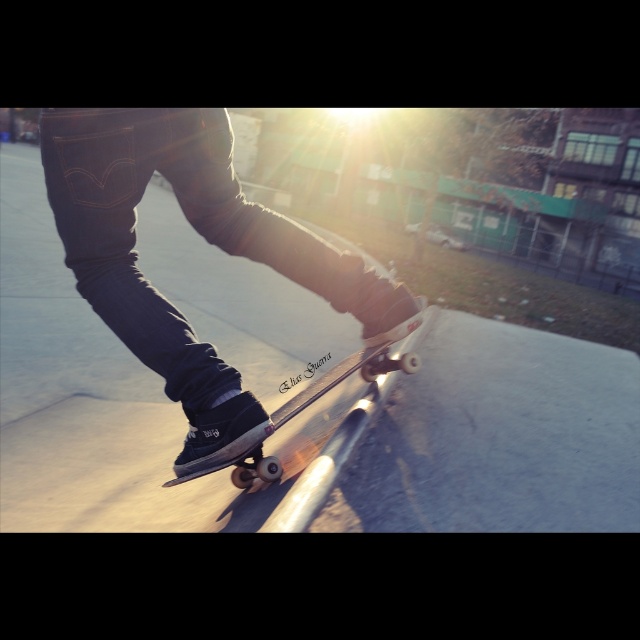
Question: Which object is closer to the camera taking this photo?

Choices:
 (A) matte black skateboarding shoe at center
 (B) wooden skateboard at center

Answer: (A)

Question: Can you confirm if matte black skateboarding shoe at center is positioned to the left of wooden skateboard at center?

Choices:
 (A) yes
 (B) no

Answer: (A)

Question: Can you confirm if matte black skateboarding shoe at center is positioned to the right of wooden skateboard at center?

Choices:
 (A) yes
 (B) no

Answer: (B)

Question: Can you confirm if matte black skateboarding shoe at center is positioned above wooden skateboard at center?

Choices:
 (A) no
 (B) yes

Answer: (B)

Question: Which point is closer to the camera taking this photo?

Choices:
 (A) (209, 429)
 (B) (314, 392)

Answer: (A)